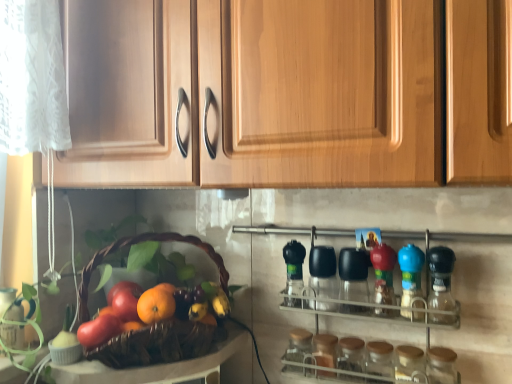
Question: Does matte red apple at lower left, the 2th apple positioned from the back, lie in front of green matte bottle at center, marked as the fourth bottle in a right-to-left arrangement?

Choices:
 (A) yes
 (B) no

Answer: (A)

Question: Is matte red apple at lower left, placed as the 1th apple when sorted from front to back, not within green matte bottle at center, which appears as the 1th bottle when viewed from the left?

Choices:
 (A) no
 (B) yes

Answer: (B)

Question: From a real-world perspective, is matte red apple at lower left, placed as the 1th apple when sorted from front to back, on green matte bottle at center, which appears as the 1th bottle when viewed from the left?

Choices:
 (A) yes
 (B) no

Answer: (B)

Question: Is matte red apple at lower left, the 2th apple positioned from the back, smaller than green matte bottle at center, which appears as the 1th bottle when viewed from the left?

Choices:
 (A) no
 (B) yes

Answer: (B)

Question: Are matte red apple at lower left, placed as the 1th apple when sorted from front to back, and green matte bottle at center, marked as the fourth bottle in a right-to-left arrangement, located far from each other?

Choices:
 (A) yes
 (B) no

Answer: (B)

Question: Is matte red apple at lower left, placed as the 1th apple when sorted from front to back, at the left side of green matte bottle at center, marked as the fourth bottle in a right-to-left arrangement?

Choices:
 (A) no
 (B) yes

Answer: (B)

Question: From a real-world perspective, is shiny purple grapes at center located beneath blue plastic bottle at right, placed as the 3th bottle when sorted from left to right?

Choices:
 (A) yes
 (B) no

Answer: (A)

Question: Can you confirm if shiny purple grapes at center is smaller than blue plastic bottle at right, placed as the 3th bottle when sorted from left to right?

Choices:
 (A) no
 (B) yes

Answer: (B)

Question: Is shiny purple grapes at center positioned with its back to blue plastic bottle at right, the second bottle viewed from the right?

Choices:
 (A) no
 (B) yes

Answer: (A)

Question: Considering the relative positions of shiny purple grapes at center and blue plastic bottle at right, placed as the 3th bottle when sorted from left to right, in the image provided, is shiny purple grapes at center to the left of blue plastic bottle at right, placed as the 3th bottle when sorted from left to right, from the viewer's perspective?

Choices:
 (A) no
 (B) yes

Answer: (B)

Question: Considering the relative sizes of shiny purple grapes at center and blue plastic bottle at right, placed as the 3th bottle when sorted from left to right, in the image provided, is shiny purple grapes at center taller than blue plastic bottle at right, placed as the 3th bottle when sorted from left to right,?

Choices:
 (A) no
 (B) yes

Answer: (A)

Question: Is shiny purple grapes at center shorter than blue plastic bottle at right, the second bottle viewed from the right?

Choices:
 (A) no
 (B) yes

Answer: (B)

Question: Is transparent glass jar at lower center, positioned as the 3th bottle in right-to-left order, completely or partially inside orange matte at center?

Choices:
 (A) no
 (B) yes

Answer: (A)